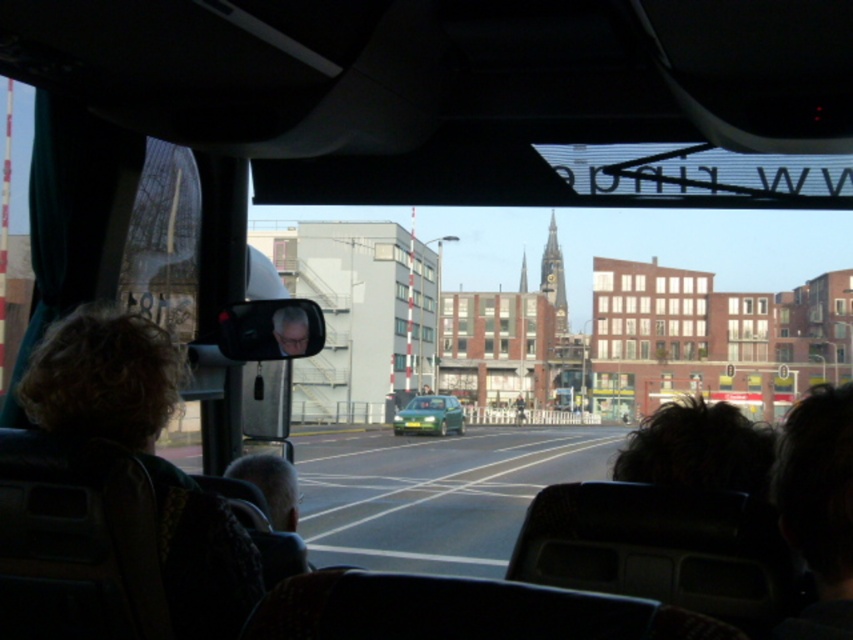
Does point (796, 513) lie behind point (271, 472)?

No, it is in front of (271, 472).

Who is taller, dark brown hair at upper right or gray hair at center?

Standing taller between the two is dark brown hair at upper right.

The width and height of the screenshot is (853, 640). In order to click on dark brown hair at upper right in this screenshot , I will do `click(817, 508)`.

Is gray hair at center below matte plastic face at center?

Correct, gray hair at center is located below matte plastic face at center.

Is point (283, 508) in front of point (300, 316)?

Yes, point (283, 508) is closer to viewer.

The height and width of the screenshot is (640, 853). What are the coordinates of `gray hair at center` in the screenshot? It's located at (270, 484).

Does dark brown hair at upper right have a larger size compared to matte plastic face at center?

Correct, dark brown hair at upper right is larger in size than matte plastic face at center.

Is point (830, 561) behind point (281, 339)?

No, it is not.

You are a GUI agent. You are given a task and a screenshot of the screen. Output one action in this format:
    pyautogui.click(x=<x>, y=<y>)
    Task: Click on the dark brown hair at upper right
    
    Given the screenshot: What is the action you would take?
    pyautogui.click(x=817, y=508)